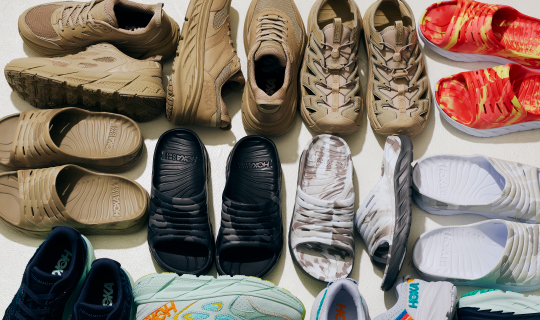
You are a GUI agent. You are given a task and a screenshot of the screen. Output one action in this format:
    pyautogui.click(x=<x>, y=<y>)
    Task: Click on the pairs of shoes
    
    Given the screenshot: What is the action you would take?
    pyautogui.click(x=68, y=294), pyautogui.click(x=40, y=158), pyautogui.click(x=77, y=40), pyautogui.click(x=237, y=47), pyautogui.click(x=363, y=35), pyautogui.click(x=526, y=57), pyautogui.click(x=354, y=211), pyautogui.click(x=210, y=241), pyautogui.click(x=522, y=210), pyautogui.click(x=368, y=312)